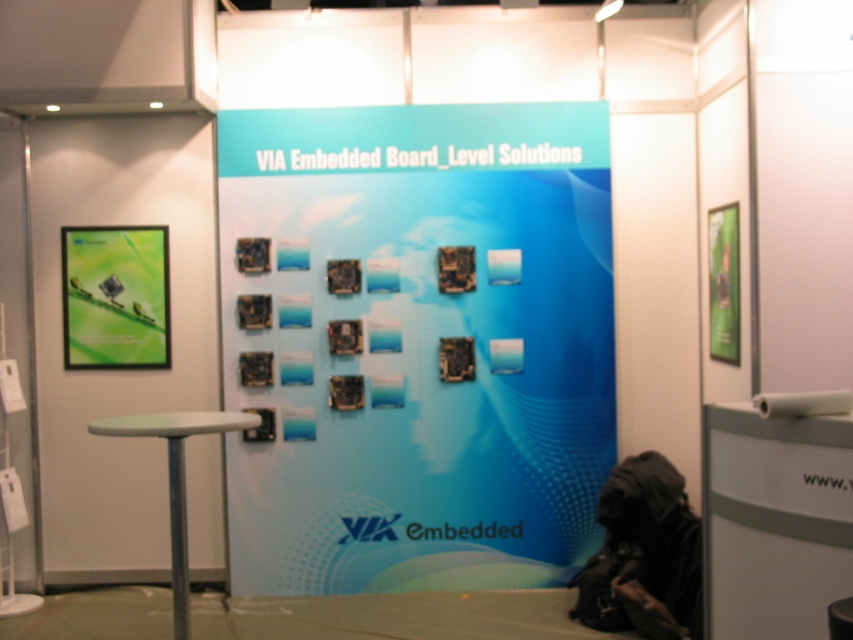
Question: Is green glossy poster at upper left behind white plastic stool at lower left?

Choices:
 (A) yes
 (B) no

Answer: (A)

Question: Is blue glossy board at center above white plastic stool at lower left?

Choices:
 (A) yes
 (B) no

Answer: (A)

Question: Estimate the real-world distances between objects in this image. Which object is closer to the blue glossy board at center?

Choices:
 (A) white plastic stool at lower left
 (B) green glossy poster at upper left

Answer: (B)

Question: Among these objects, which one is farthest from the camera?

Choices:
 (A) green glossy poster at upper left
 (B) white plastic stool at lower left

Answer: (A)

Question: Based on their relative distances, which object is farther from the blue glossy board at center?

Choices:
 (A) white plastic stool at lower left
 (B) green glossy poster at upper left

Answer: (A)

Question: Does green glossy poster at upper left have a larger size compared to white plastic stool at lower left?

Choices:
 (A) yes
 (B) no

Answer: (B)